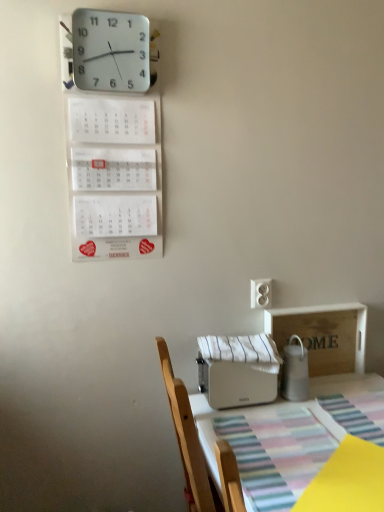
Question: From a real-world perspective, is white striped fabric at center below white plastic electric outlet at center-right?

Choices:
 (A) yes
 (B) no

Answer: (A)

Question: Is white striped fabric at center aimed at white plastic electric outlet at center-right?

Choices:
 (A) no
 (B) yes

Answer: (A)

Question: Does white striped fabric at center have a greater width compared to white plastic electric outlet at center-right?

Choices:
 (A) no
 (B) yes

Answer: (B)

Question: Is white striped fabric at center in contact with white plastic electric outlet at center-right?

Choices:
 (A) yes
 (B) no

Answer: (B)

Question: From a real-world perspective, is white striped fabric at center located higher than white plastic electric outlet at center-right?

Choices:
 (A) yes
 (B) no

Answer: (B)

Question: Based on their sizes in the image, would you say white paper calendar at upper left is bigger or smaller than white plastic toaster at lower center, the second appliance from the right?

Choices:
 (A) big
 (B) small

Answer: (B)

Question: Is white paper calendar at upper left to the left or to the right of white plastic toaster at lower center, the second appliance from the right, in the image?

Choices:
 (A) right
 (B) left

Answer: (B)

Question: In terms of height, does white paper calendar at upper left look taller or shorter compared to white plastic toaster at lower center, positioned as the first appliance in left-to-right order?

Choices:
 (A) short
 (B) tall

Answer: (B)

Question: Considering the positions of point (94, 175) and point (264, 369), is point (94, 175) closer or farther from the camera than point (264, 369)?

Choices:
 (A) farther
 (B) closer

Answer: (B)

Question: Relative to white glossy milk jug at right, placed as the 2th appliance when sorted from left to right, is white paper calendar at upper left in front or behind?

Choices:
 (A) front
 (B) behind

Answer: (A)

Question: In terms of size, does white paper calendar at upper left appear bigger or smaller than white glossy milk jug at right, acting as the 1th appliance starting from the right?

Choices:
 (A) small
 (B) big

Answer: (B)

Question: Considering the positions of white paper calendar at upper left and white glossy milk jug at right, placed as the 2th appliance when sorted from left to right, in the image, is white paper calendar at upper left taller or shorter than white glossy milk jug at right, placed as the 2th appliance when sorted from left to right,?

Choices:
 (A) short
 (B) tall

Answer: (B)

Question: From a real-world perspective, is white paper calendar at upper left above or below white glossy milk jug at right, placed as the 2th appliance when sorted from left to right?

Choices:
 (A) below
 (B) above

Answer: (B)

Question: Considering the positions of point (288, 493) and point (211, 356), is point (288, 493) closer or farther from the camera than point (211, 356)?

Choices:
 (A) farther
 (B) closer

Answer: (B)

Question: Considering the positions of white plastic toaster at lower center and white striped fabric at center in the image, is white plastic toaster at lower center taller or shorter than white striped fabric at center?

Choices:
 (A) tall
 (B) short

Answer: (A)